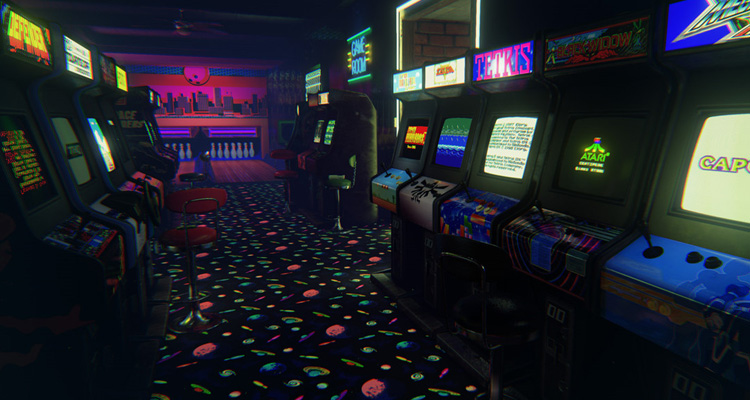
The height and width of the screenshot is (400, 750). What are the coordinates of `tetris arcade cabinet` in the screenshot? It's located at (501, 60).